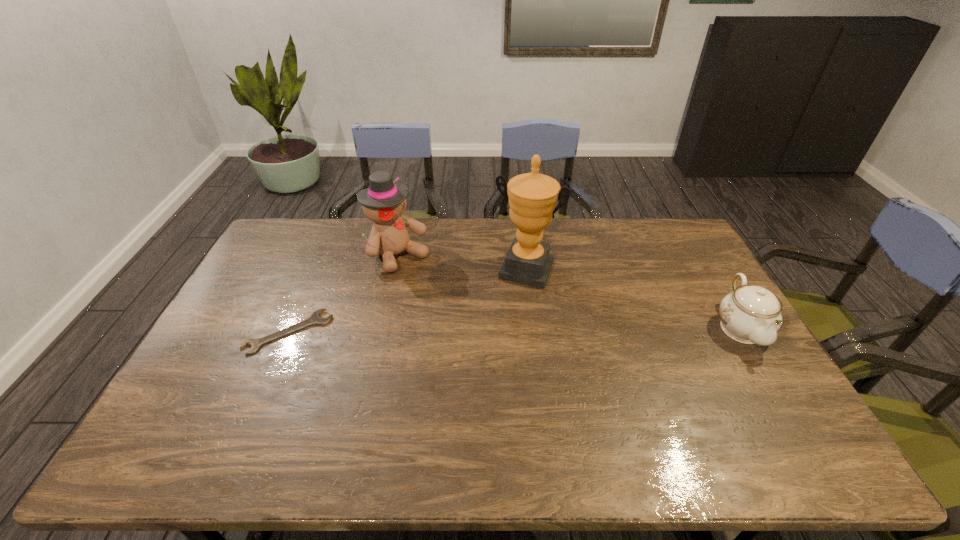
Image resolution: width=960 pixels, height=540 pixels. In the image, there is a desktop. What are the coordinates of `vacant area at the far edge` in the screenshot? It's located at (487, 252).

Where is `free space at the near edge of the desktop`? The image size is (960, 540). free space at the near edge of the desktop is located at coordinates (319, 411).

Identify the location of blank space at the left edge of the desktop. (289, 265).

Locate an element on the screen. free space at the right edge of the desktop is located at coordinates (706, 302).

At what (x,y) coordinates should I click in order to perform the action: click on blank area at the far left corner. Please return your answer as a coordinate pair (x, y). The image size is (960, 540). Looking at the image, I should click on (278, 232).

This screenshot has height=540, width=960. Identify the location of free spot between the chinaware and the shortest object. (515, 330).

Where is `free spot between the award and the third object from right to left`? Image resolution: width=960 pixels, height=540 pixels. free spot between the award and the third object from right to left is located at coordinates (462, 262).

Find the location of a particular element. vacant area between the second shortest object and the tallest object is located at coordinates (633, 299).

Identify the location of empty space between the second shortest object and the leftmost object. The image size is (960, 540). (515, 330).

Where is `empty space that is in between the rag_doll and the rightmost object`? This screenshot has height=540, width=960. empty space that is in between the rag_doll and the rightmost object is located at coordinates (569, 292).